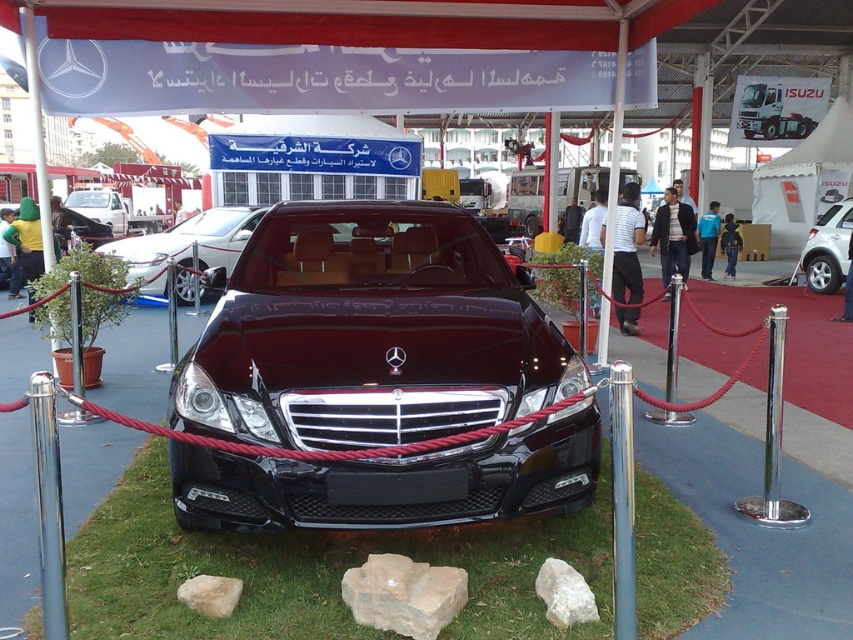
You are a photographer at the car exhibition. You need to capture a photo that includes both the green grass at center and the shiny black car at center. Which object should you focus on first to ensure both are in frame?

The shiny black car at center is larger than the green grass at center, so you should focus on the shiny black car at center first to ensure it fits in the frame while also including the smaller green grass at center.

You are a photographer at the car exhibition. You need to capture a photo that includes both the silver metallic sedan at center and the white smooth rock at lower center. Given their sizes, which object should you position closer to the camera to ensure both are visible in the frame without cropping?

The silver metallic sedan at center is larger than the white smooth rock at lower center, so you should position the white smooth rock at lower center closer to the camera to balance their sizes in the photo frame.

You are standing at the car exhibition and want to take a photo of the two points mentioned. Which point, point [253,598] or point [218,230], is closer to you?

Point [253,598] is closer to the viewer than point [218,230].